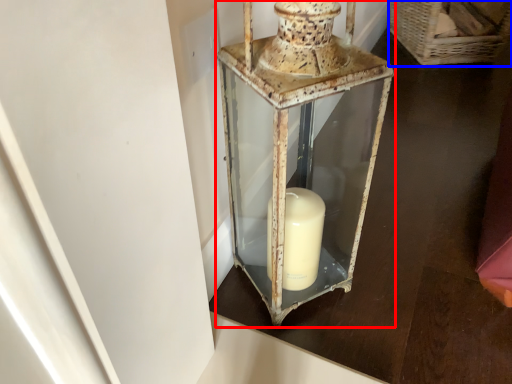
Question: Which object appears farthest to the camera in this image, lantern (highlighted by a red box) or basket (highlighted by a blue box)?

Choices:
 (A) lantern
 (B) basket

Answer: (B)